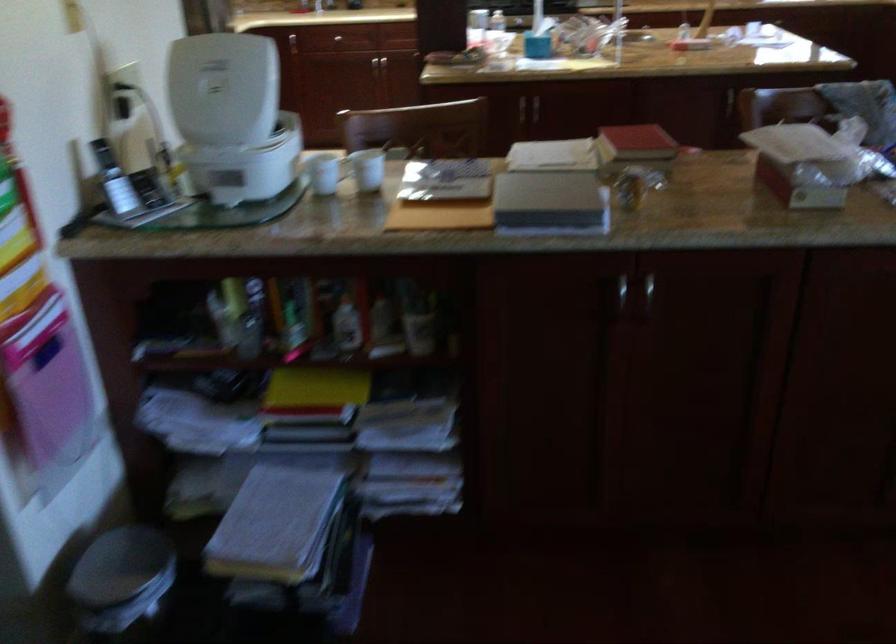
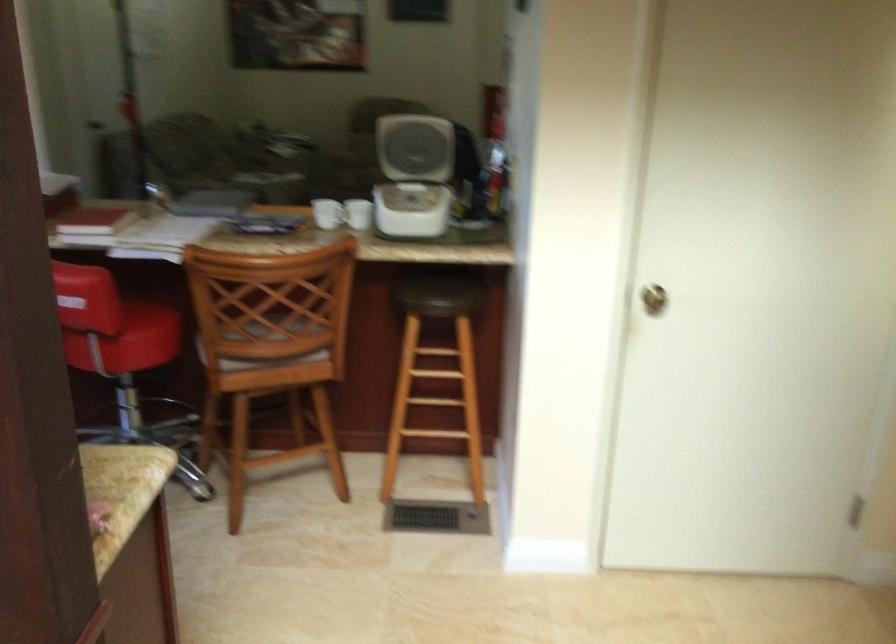
In the second image, find the point that corresponds to point 627,135 in the first image.

(93, 223)